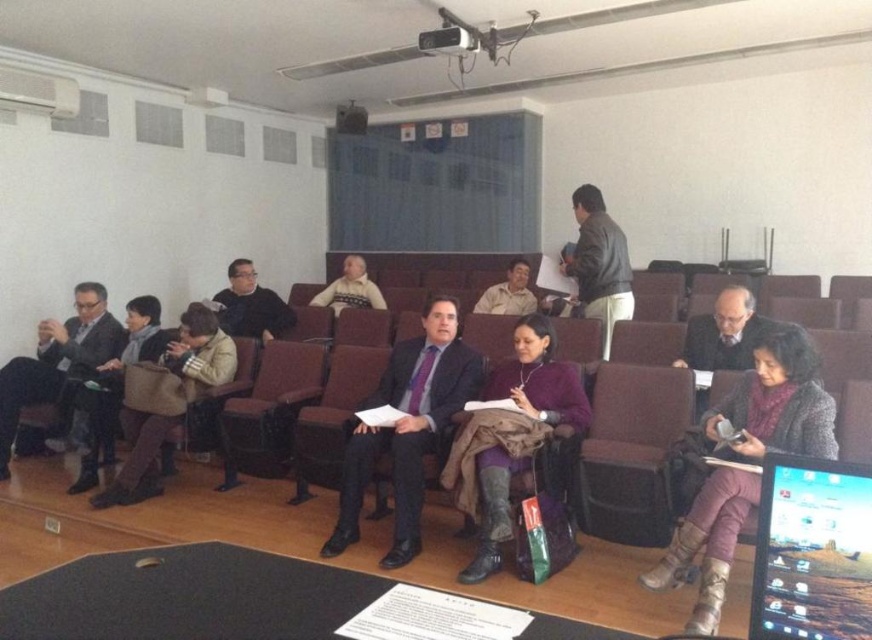
Can you confirm if dark brown leather chair at center is thinner than knitted sweater at center?

Indeed, dark brown leather chair at center has a lesser width compared to knitted sweater at center.

Consider the image. Does dark brown leather chair at center have a greater width compared to knitted sweater at center?

No, dark brown leather chair at center is not wider than knitted sweater at center.

Who is more distant from viewer, [341,385] or [356,259]?

Positioned behind is point [356,259].

What are the coordinates of `dark brown leather chair at center` in the screenshot? It's located at (332, 417).

Between point (796, 369) and point (596, 384), which one is positioned behind?

The point (596, 384) is behind.

Is purple wool scarf at center to the right of brown fabric chair at center from the viewer's perspective?

Yes, purple wool scarf at center is to the right of brown fabric chair at center.

Does point (814, 392) come behind point (665, 460)?

No, it is in front of (665, 460).

Where is `purple wool scarf at center`? The image size is (872, 640). purple wool scarf at center is located at coordinates (775, 403).

Is brown fabric chair at center bigger than brown leather chair at center?

Actually, brown fabric chair at center might be smaller than brown leather chair at center.

The width and height of the screenshot is (872, 640). What do you see at coordinates (630, 452) in the screenshot?
I see `brown fabric chair at center` at bounding box center [630, 452].

Where is `brown fabric chair at center`? The width and height of the screenshot is (872, 640). brown fabric chair at center is located at coordinates (630, 452).